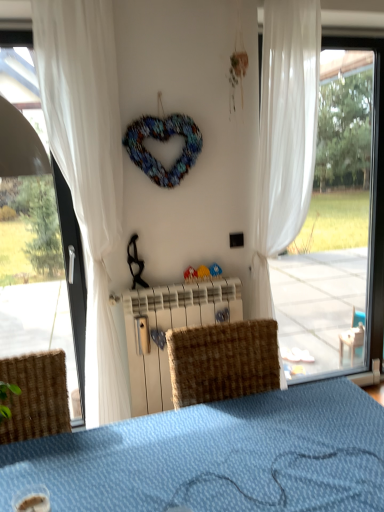
Question: Do you think white sheer curtain at center, which is the second curtain in left-to-right order, is within transparent glass window at right, or outside of it?

Choices:
 (A) outside
 (B) inside

Answer: (A)

Question: Based on their positions, is white sheer curtain at center, which is the second curtain in left-to-right order, located to the left or right of transparent glass window at right?

Choices:
 (A) right
 (B) left

Answer: (B)

Question: Based on their relative distances, which object is farther from the translucent plastic cup at lower left?

Choices:
 (A) white plastic radiator at center
 (B) transparent glass window at right
 (C) white sheer curtain at left, which is the 1th curtain from left to right
 (D) white sheer curtain at center, the first curtain in the right-to-left sequence

Answer: (D)

Question: Which object is the farthest from the white plastic radiator at center?

Choices:
 (A) transparent glass window at right
 (B) white sheer curtain at left, the second curtain when ordered from right to left
 (C) translucent plastic cup at lower left
 (D) white sheer curtain at center, the first curtain in the right-to-left sequence

Answer: (C)